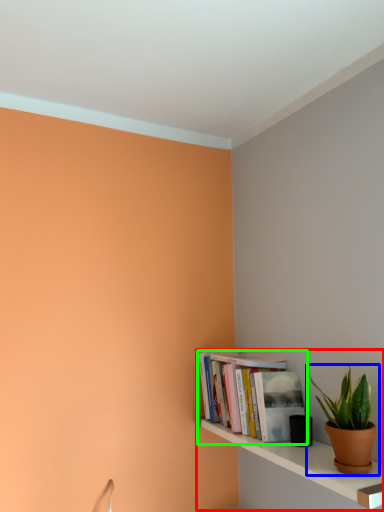
Question: Considering the real-world distances, which object is farthest from shelf (highlighted by a red box)? houseplant (highlighted by a blue box) or book (highlighted by a green box)?

Choices:
 (A) houseplant
 (B) book

Answer: (A)